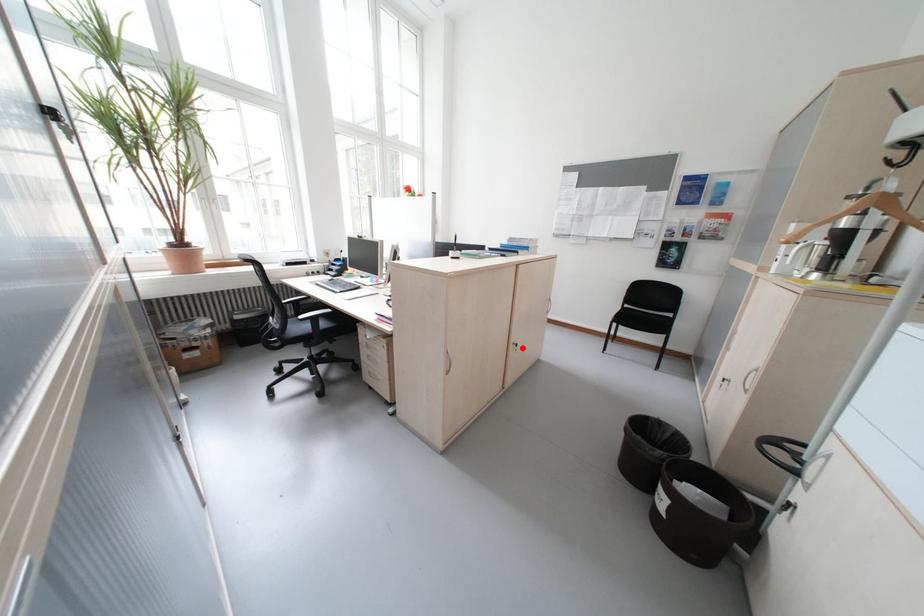
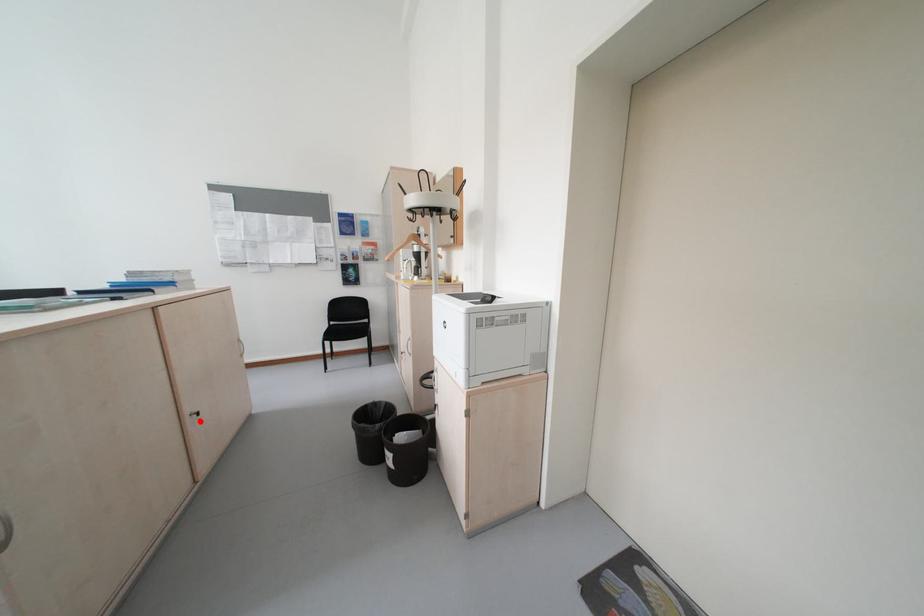
I am providing you with two images of the same scene from different viewpoints. A red point is marked on the first image and another point is marked on the second image. Are the points marked in image1 and image2 representing the same 3D position?

Yes